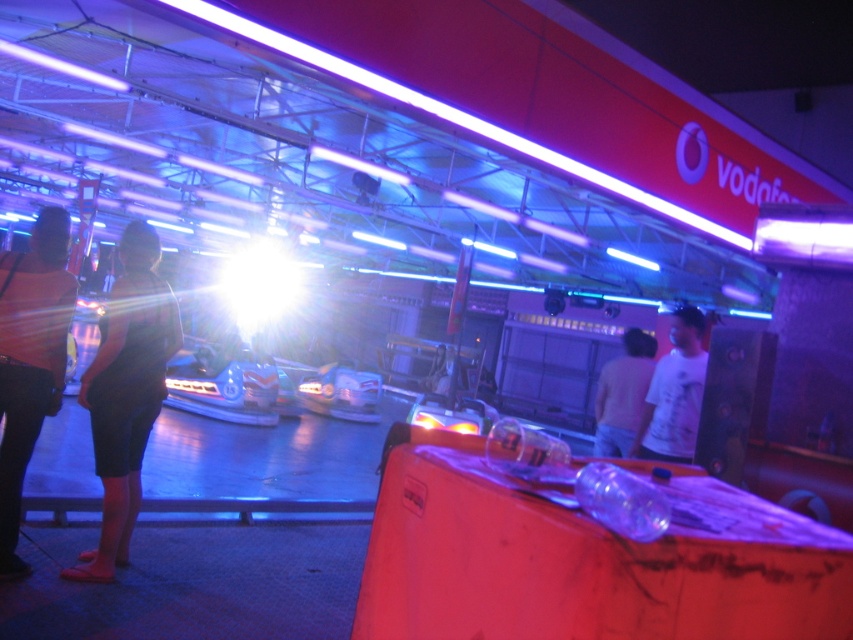
You are a photographer standing at the center of the amusement park. You want to take a photo that includes both the bright red trash bin in the foreground and the Vodafone sign in the background. Which of the two points, point 1 at coordinates (231, 385) or point 2 at coordinates (613, 428), is closer to your camera lens?

Point 1 at coordinates (231, 385) is closer to the camera lens because it is further to the camera than point 2 at coordinates (613, 428).

You are a photographer trying to capture both the dark fabric shorts at left and the light brown shirt at center in a single frame. Which object should you focus on first to ensure both are in the frame without moving the camera?

You should focus on the dark fabric shorts at left first because it is larger in size compared to the light brown shirt at center, ensuring it fits within the frame while the smaller shirt remains visible.